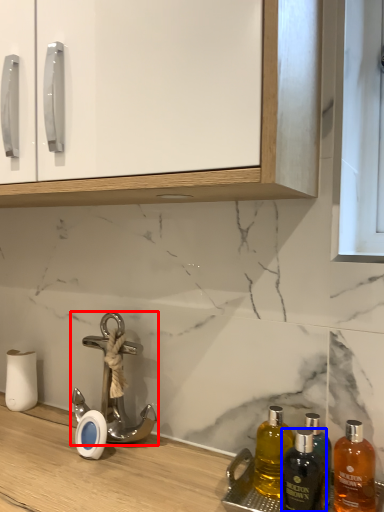
Question: Which point is closer to the camera, tap (highlighted by a red box) or bottle (highlighted by a blue box)?

Choices:
 (A) tap
 (B) bottle

Answer: (B)